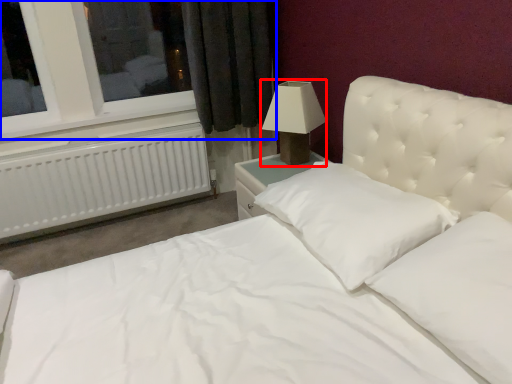
Question: Which object appears closest to the camera in this image, lamp (highlighted by a red box) or window (highlighted by a blue box)?

Choices:
 (A) lamp
 (B) window

Answer: (A)